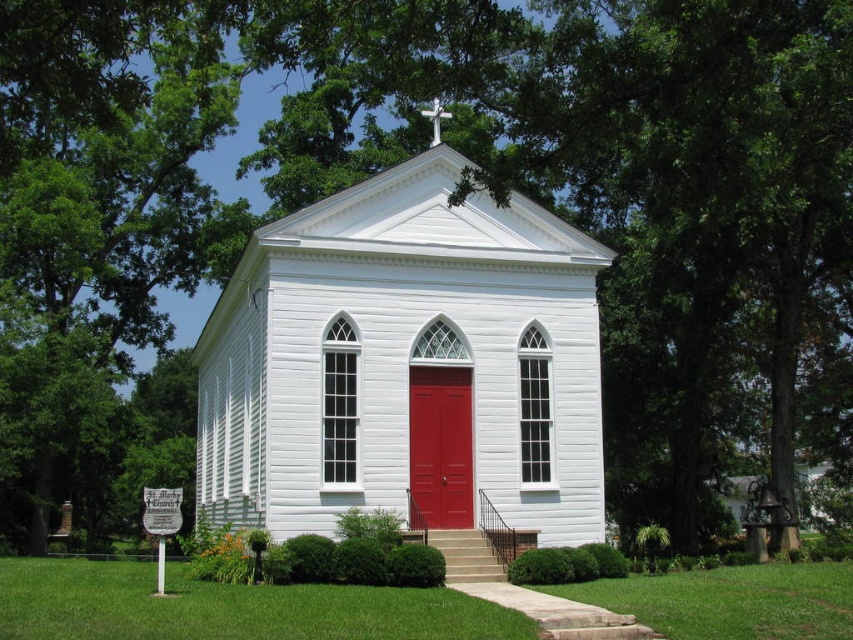
Can you confirm if white wood chapel at center is taller than matte wood door at center?

Indeed, white wood chapel at center has a greater height compared to matte wood door at center.

Can you confirm if white wood chapel at center is positioned to the left of matte wood door at center?

Correct, you'll find white wood chapel at center to the left of matte wood door at center.

Does point (277, 465) come closer to viewer compared to point (413, 513)?

That is True.

You are a GUI agent. You are given a task and a screenshot of the screen. Output one action in this format:
    pyautogui.click(x=<x>, y=<y>)
    Task: Click on the white wood chapel at center
    
    Given the screenshot: What is the action you would take?
    pyautogui.click(x=408, y=369)